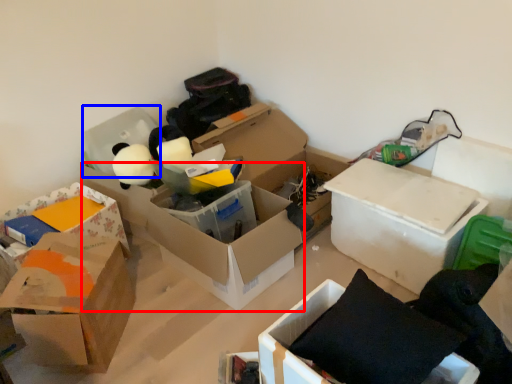
Question: Among these objects, which one is farthest to the camera, box (highlighted by a red box) or storage box (highlighted by a blue box)?

Choices:
 (A) box
 (B) storage box

Answer: (B)